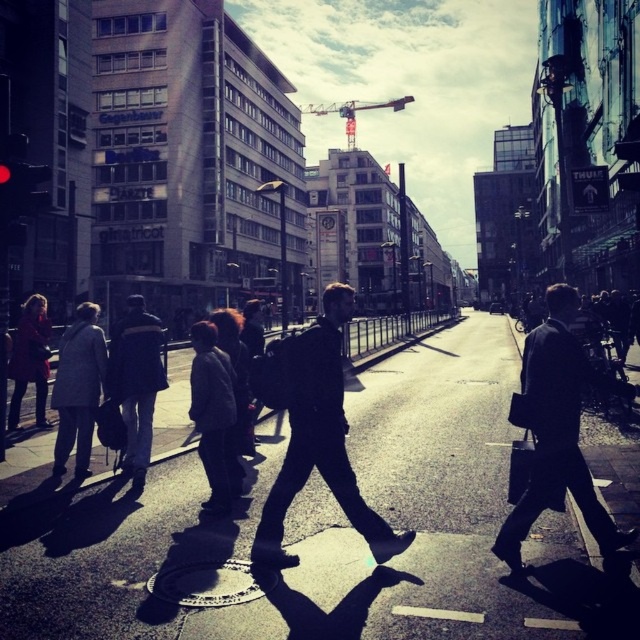
Question: Which object is positioned closest to the dark brown leather jacket at left?

Choices:
 (A) dark gray jacket at left
 (B) metallic construction crane at upper center
 (C) dark suit at center
 (D) dark gray coat at left

Answer: (D)

Question: Which point is farther to the camera?

Choices:
 (A) (208, 420)
 (B) (45, 392)

Answer: (B)

Question: Is dark suit at center to the left of dark gray jacket at center from the viewer's perspective?

Choices:
 (A) yes
 (B) no

Answer: (B)

Question: Which object is positioned closest to the dark matte jacket at center?

Choices:
 (A) dark gray jacket at center
 (B) metallic construction crane at upper center

Answer: (A)

Question: Can you confirm if dark gray jacket at center is smaller than dark gray coat at left?

Choices:
 (A) no
 (B) yes

Answer: (B)

Question: In this image, where is dark suit at center located relative to dark gray coat at left?

Choices:
 (A) left
 (B) right

Answer: (B)